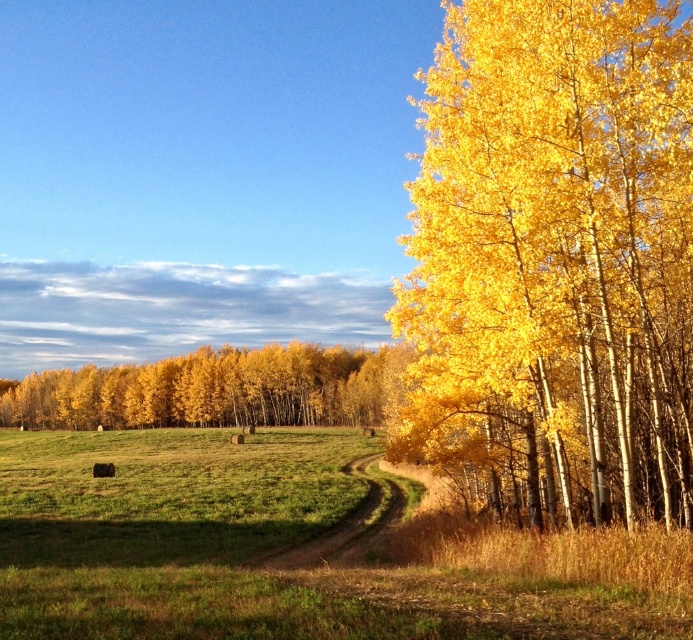
Is point (453, 380) positioned after point (256, 400)?

No, (453, 380) is in front of (256, 400).

Locate an element on the screen. The image size is (693, 640). golden yellow leaves at right is located at coordinates (554, 257).

Is point (139, 420) farther from camera compared to point (344, 552)?

Yes, point (139, 420) is behind point (344, 552).

Is point (204, 397) in front of point (378, 481)?

No, (204, 397) is further to viewer.

Where is `golden yellow leaves at center`? Image resolution: width=693 pixels, height=640 pixels. golden yellow leaves at center is located at coordinates (216, 388).

In the scene shown: Which of these two, golden yellow leaves at right or brown dirt path at center, stands taller?

golden yellow leaves at right

Can you confirm if golden yellow leaves at right is smaller than brown dirt path at center?

Incorrect, golden yellow leaves at right is not smaller in size than brown dirt path at center.

Identify the location of golden yellow leaves at right. (554, 257).